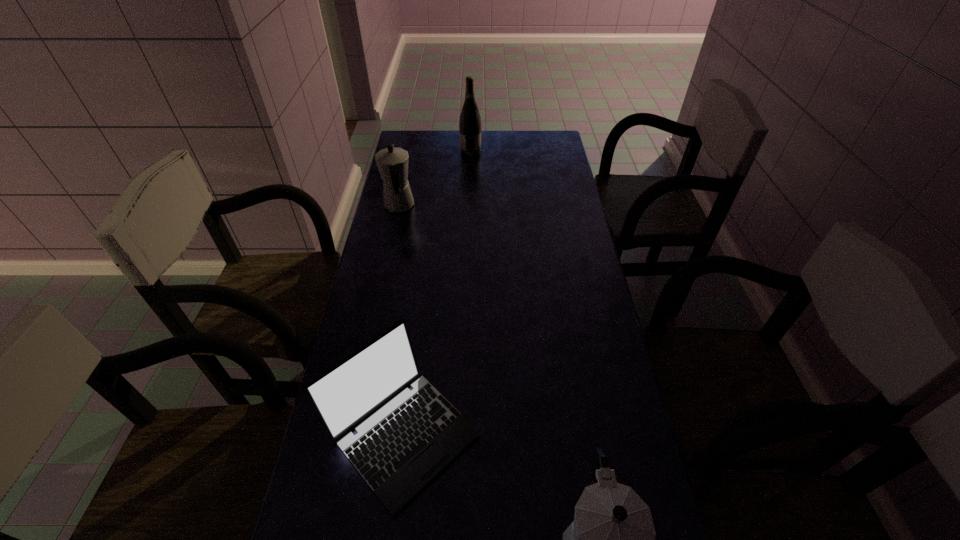
Choose which object is the third nearest neighbor to the laptop_computer. Please provide its 2D coordinates. Your answer should be formatted as a tuple, i.e. [(x, y)], where the tuple contains the x and y coordinates of a point satisfying the conditions above.

[(470, 122)]

The height and width of the screenshot is (540, 960). I want to click on free location that satisfies the following two spatial constraints: 1. on the label of the wine bottle; 2. at the front screen of the shortest object, so click(463, 433).